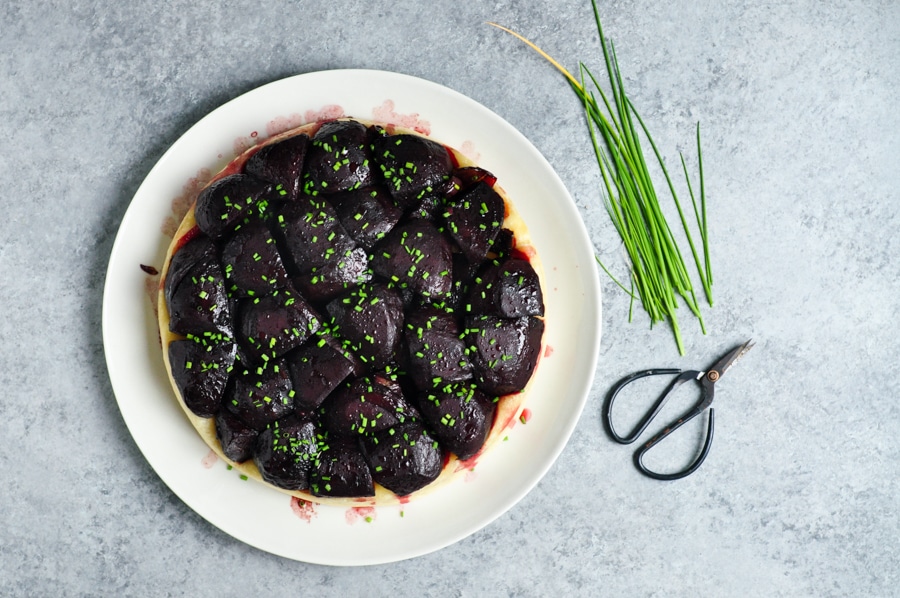
Identify the location of plate. The width and height of the screenshot is (900, 598). (568, 227).